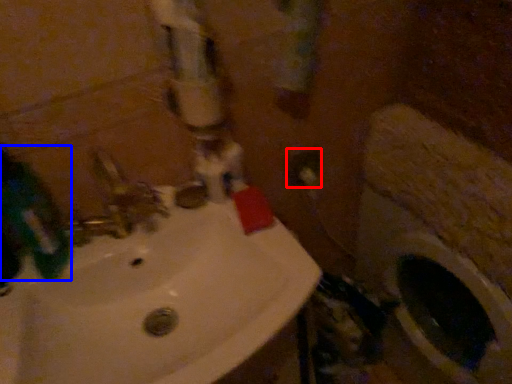
Question: Which point is closer to the camera, electric outlet (highlighted by a red box) or mouthwash (highlighted by a blue box)?

Choices:
 (A) electric outlet
 (B) mouthwash

Answer: (B)